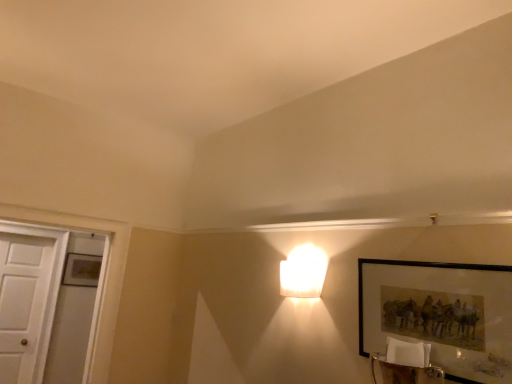
Question: Is white frosted glass lamp at upper center located within white wooden door at left?

Choices:
 (A) yes
 (B) no

Answer: (B)

Question: Does white wooden door at left have a greater height compared to white frosted glass lamp at upper center?

Choices:
 (A) yes
 (B) no

Answer: (A)

Question: From the image's perspective, is white wooden door at left on top of white frosted glass lamp at upper center?

Choices:
 (A) yes
 (B) no

Answer: (B)

Question: Is white wooden door at left positioned in front of white frosted glass lamp at upper center?

Choices:
 (A) yes
 (B) no

Answer: (B)

Question: From a real-world perspective, is white wooden door at left located beneath white frosted glass lamp at upper center?

Choices:
 (A) no
 (B) yes

Answer: (B)

Question: Is white wooden door at left positioned far away from white frosted glass lamp at upper center?

Choices:
 (A) yes
 (B) no

Answer: (A)

Question: Is white wooden door at left wider than matte black picture frame at lower right?

Choices:
 (A) yes
 (B) no

Answer: (A)

Question: Is white wooden door at left placed right next to matte black picture frame at lower right?

Choices:
 (A) yes
 (B) no

Answer: (B)

Question: Considering the relative sizes of white wooden door at left and matte black picture frame at lower right in the image provided, is white wooden door at left shorter than matte black picture frame at lower right?

Choices:
 (A) no
 (B) yes

Answer: (A)

Question: From the image's perspective, is white wooden door at left located above matte black picture frame at lower right?

Choices:
 (A) yes
 (B) no

Answer: (B)

Question: Considering the relative sizes of white wooden door at left and matte black picture frame at lower right in the image provided, is white wooden door at left thinner than matte black picture frame at lower right?

Choices:
 (A) no
 (B) yes

Answer: (A)

Question: Is matte black picture frame at lower right at the back of white wooden door at left?

Choices:
 (A) no
 (B) yes

Answer: (A)

Question: Does matte black picture frame at lower right appear on the right side of white wooden door at left?

Choices:
 (A) no
 (B) yes

Answer: (B)